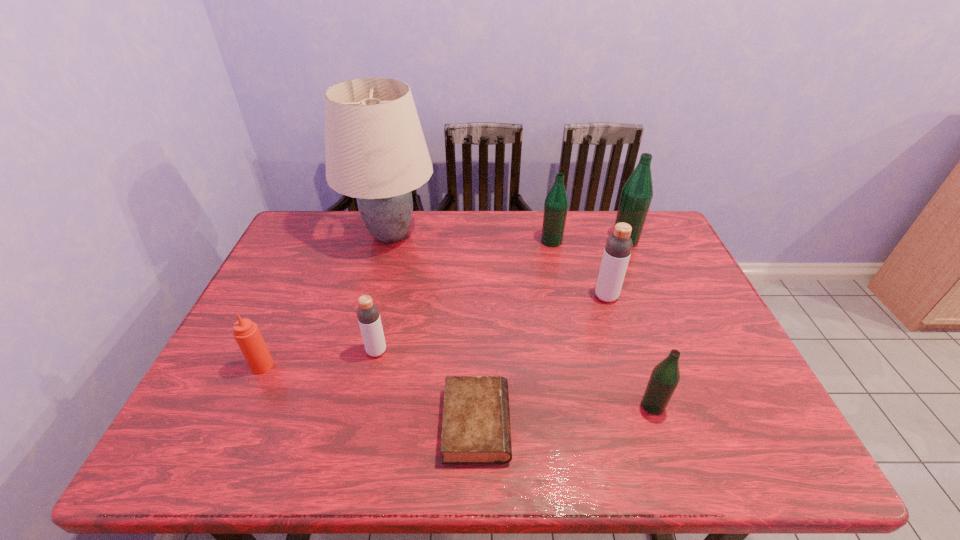
Find the location of a particular element. The width and height of the screenshot is (960, 540). the smallest green bottle is located at coordinates (665, 376).

Find the location of a particular element. the nearest green bottle is located at coordinates (665, 376).

Where is `Tabasco sauce`? Image resolution: width=960 pixels, height=540 pixels. Tabasco sauce is located at coordinates (246, 333).

This screenshot has width=960, height=540. Find the location of `the fourth object from left to right`. the fourth object from left to right is located at coordinates (476, 429).

Locate an element on the screen. The width and height of the screenshot is (960, 540). diary is located at coordinates (476, 429).

You are a GUI agent. You are given a task and a screenshot of the screen. Output one action in this format:
    pyautogui.click(x=<x>, y=<y>)
    Task: Click on the vacant point located on the front of the lampshade
    The height and width of the screenshot is (540, 960).
    Given the screenshot: What is the action you would take?
    pyautogui.click(x=369, y=320)

Find the location of a particular element. This screenshot has height=540, width=960. free location located 0.290m on the front of the rightmost object is located at coordinates [656, 314].

Locate an element on the screen. The width and height of the screenshot is (960, 540). free spot located 0.190m on the left of the fifth object from left to right is located at coordinates (482, 241).

You are a GUI agent. You are given a task and a screenshot of the screen. Output one action in this format:
    pyautogui.click(x=<x>, y=<y>)
    Task: Click on the free space located on the back of the fourth farthest object
    The image size is (960, 540).
    Given the screenshot: What is the action you would take?
    pyautogui.click(x=595, y=262)

Locate an element on the screen. This screenshot has width=960, height=540. vacant area situated on the back of the smaller gray bottle is located at coordinates (393, 279).